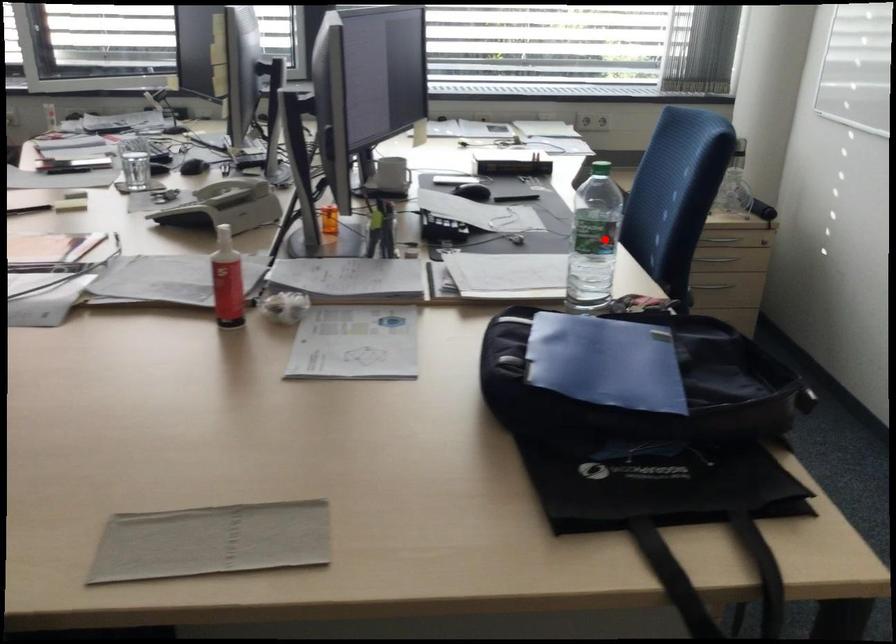
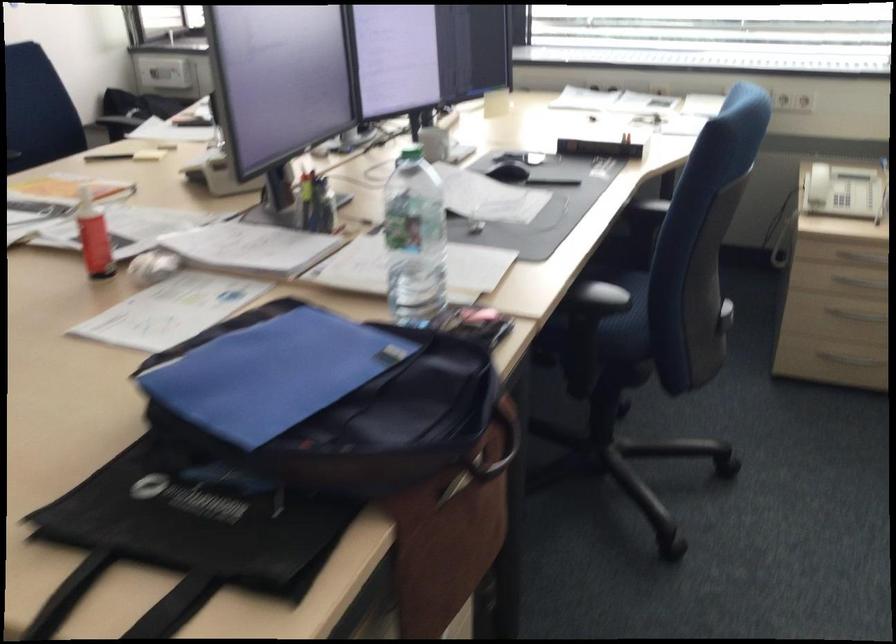
Question: I am providing you with two images of the same scene from different viewpoints. Image1 has a red point marked. In image2, the corresponding 3D location appears at what relative position? Reply with the corresponding letter.

Choices:
 (A) Closer
 (B) Farther

Answer: (A)